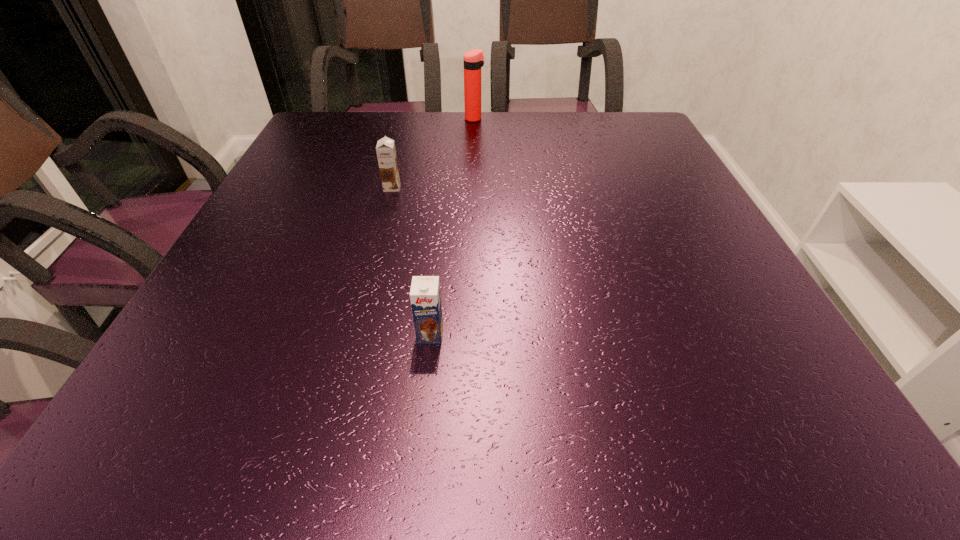
This screenshot has height=540, width=960. Identify the location of the farthest object. (473, 60).

Identify the location of the rightmost object. (473, 60).

Where is `the farther chocolate milk`? the farther chocolate milk is located at coordinates (386, 153).

Find the location of a particular element. the second nearest object is located at coordinates (386, 153).

The height and width of the screenshot is (540, 960). Identify the location of the second object from left to right. (425, 297).

What are the coordinates of `the nearer chocolate milk` in the screenshot? It's located at (425, 297).

You are a GUI agent. You are given a task and a screenshot of the screen. Output one action in this format:
    pyautogui.click(x=<x>, y=<y>)
    Task: Click on the free space located on the right of the farthest object
    The width and height of the screenshot is (960, 540).
    Given the screenshot: What is the action you would take?
    pyautogui.click(x=516, y=119)

At what (x,y) coordinates should I click in order to perform the action: click on vacant region located on the front of the second nearest object. Please return your answer as a coordinate pair (x, y). The height and width of the screenshot is (540, 960). Looking at the image, I should click on (359, 313).

Where is `free spot located on the front label of the second object from right to left`? The image size is (960, 540). free spot located on the front label of the second object from right to left is located at coordinates (426, 370).

At what (x,y) coordinates should I click in order to perform the action: click on object present at the far edge. Please return your answer as a coordinate pair (x, y). Looking at the image, I should click on (473, 60).